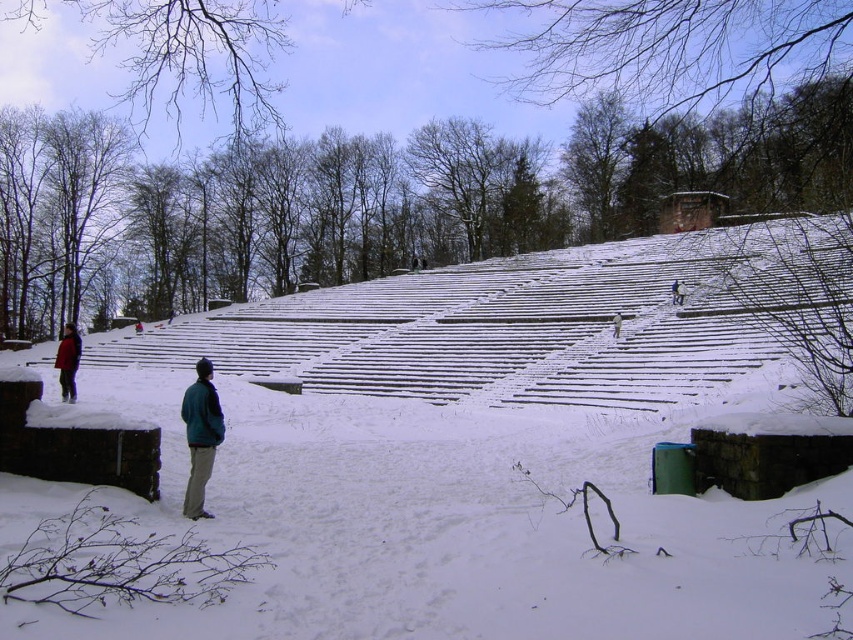
You are standing in the snowy park and want to walk to the point marked as point (54, 497). There is another point, point (61, 339), in the same area. Which point is closer to your current position if you are facing the scene?

Point (54, 497) is in front of point (61, 339), so it is closer to your current position when facing the scene.

You are planning to build a snowman using the white snow at center and need to place the green matte jacket at lower left nearby for decoration. Considering their sizes, which object would you use as the base of the snowman?

The white snow at center has a larger size compared to the green matte jacket at lower left, so the white snow at center would be used as the base of the snowman because it is bigger.

You are planning to take a photo of the two people in the snowy scene. The green matte jacket at lower left and the matte black jacket at lower left are both in your frame. Which person should you focus on first if you want to capture the taller individual?

The matte black jacket at lower left is taller than the green matte jacket at lower left, so you should focus on the matte black jacket at lower left first to capture the taller individual.